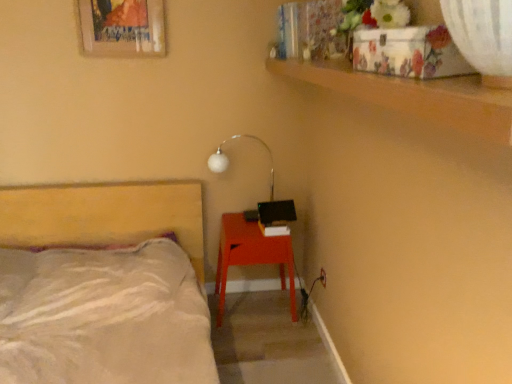
Question: Is white glossy lamp at upper center to the right of matte red nightstand at lower right from the viewer's perspective?

Choices:
 (A) no
 (B) yes

Answer: (A)

Question: Is white glossy lamp at upper center to the left of matte red nightstand at lower right from the viewer's perspective?

Choices:
 (A) no
 (B) yes

Answer: (B)

Question: Is matte red nightstand at lower right inside white glossy lamp at upper center?

Choices:
 (A) yes
 (B) no

Answer: (B)

Question: Can you confirm if white glossy lamp at upper center is shorter than matte red nightstand at lower right?

Choices:
 (A) no
 (B) yes

Answer: (B)

Question: Would you consider white glossy lamp at upper center to be distant from matte red nightstand at lower right?

Choices:
 (A) no
 (B) yes

Answer: (A)

Question: Does white glossy lamp at upper center have a lesser width compared to matte red nightstand at lower right?

Choices:
 (A) no
 (B) yes

Answer: (B)

Question: Does beige fabric bed at left have a smaller size compared to white glossy lamp at upper center?

Choices:
 (A) yes
 (B) no

Answer: (B)

Question: Could white glossy lamp at upper center be considered to be inside beige fabric bed at left?

Choices:
 (A) yes
 (B) no

Answer: (B)

Question: From a real-world perspective, is beige fabric bed at left located beneath white glossy lamp at upper center?

Choices:
 (A) yes
 (B) no

Answer: (A)

Question: From a real-world perspective, is beige fabric bed at left over white glossy lamp at upper center?

Choices:
 (A) no
 (B) yes

Answer: (A)

Question: Can you confirm if beige fabric bed at left is taller than white glossy lamp at upper center?

Choices:
 (A) no
 (B) yes

Answer: (B)

Question: From the image's perspective, is beige fabric bed at left on top of white glossy lamp at upper center?

Choices:
 (A) no
 (B) yes

Answer: (A)

Question: Does wooden picture frame at upper left appear on the left side of white glossy lamp at upper center?

Choices:
 (A) yes
 (B) no

Answer: (A)